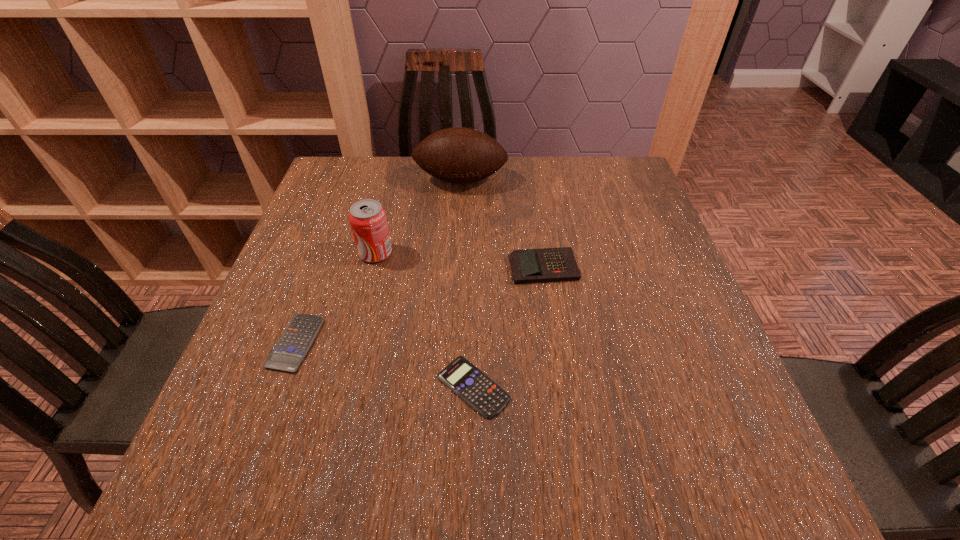
Identify the location of blank region between the soda can and the leftmost object. The width and height of the screenshot is (960, 540). (336, 298).

The height and width of the screenshot is (540, 960). I want to click on free spot between the soda can and the rightmost calculator, so click(460, 260).

The width and height of the screenshot is (960, 540). What are the coordinates of `free space that is in between the second calculator from left to right and the farthest object` in the screenshot? It's located at [468, 284].

You are a GUI agent. You are given a task and a screenshot of the screen. Output one action in this format:
    pyautogui.click(x=<x>, y=<y>)
    Task: Click on the free space between the soda can and the football
    The image size is (960, 540).
    Given the screenshot: What is the action you would take?
    pyautogui.click(x=419, y=217)

Where is `free spot between the tallest calculator and the leftmost object`? free spot between the tallest calculator and the leftmost object is located at coordinates (420, 305).

Where is `unoccupied area between the leftmost calculator and the soda can`? This screenshot has width=960, height=540. unoccupied area between the leftmost calculator and the soda can is located at coordinates (336, 298).

Where is `vacant point located between the leftmost object and the second calculator from left to right`? This screenshot has width=960, height=540. vacant point located between the leftmost object and the second calculator from left to right is located at coordinates (385, 365).

Locate an element on the screen. vacant space that is in between the leftmost calculator and the farthest calculator is located at coordinates (420, 305).

Locate an element on the screen. vacant region between the third shortest object and the football is located at coordinates (502, 224).

I want to click on object identified as the third closest to the soda can, so click(x=547, y=264).